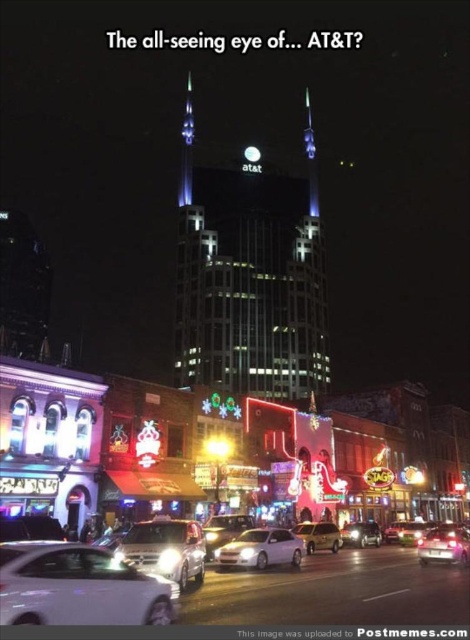
You are a pedestrian standing on the sidewalk in front of the skyscraper. You see a white matte sedan at center and a gold metallic suv at center. Which vehicle is nearer to you?

The white matte sedan at center is closer to the viewer than the gold metallic suv at center, so the white matte sedan at center is nearer to you.

You are standing on the street in front of the skyscraper and want to take a photo. There are two points marked on your camera screen at coordinates point [244,536] and point [321,545]. Which point is closer to you?

Point [244,536] is closer to the camera than point [321,545].